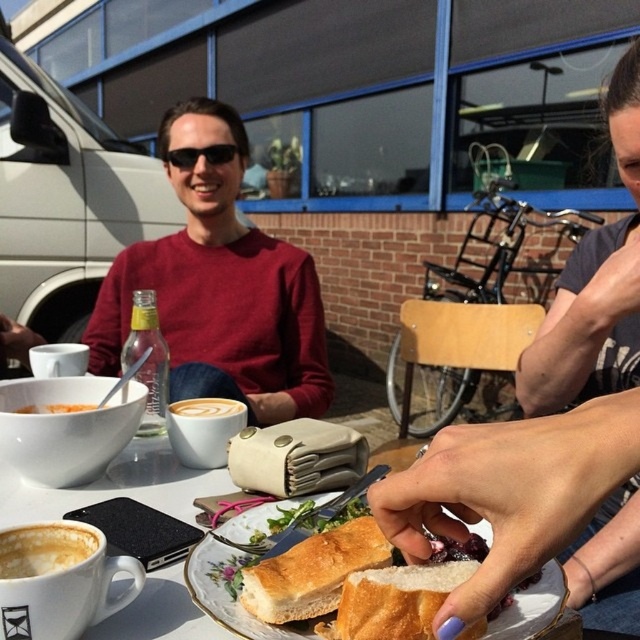
What do you see at coordinates (312, 572) in the screenshot? I see `golden bread sandwich at center` at bounding box center [312, 572].

Which is behind, point (316, 541) or point (221, 413)?

Positioned behind is point (221, 413).

Where is `golden bread sandwich at center`? Image resolution: width=640 pixels, height=640 pixels. golden bread sandwich at center is located at coordinates (312, 572).

What do you see at coordinates (312, 572) in the screenshot?
I see `golden bread sandwich at center` at bounding box center [312, 572].

Is point (314, 536) positioned in front of point (172, 161)?

Yes, it is in front of point (172, 161).

Locate an element on the screen. This screenshot has height=640, width=640. golden bread sandwich at center is located at coordinates (312, 572).

Does matte white soup at lower left have a smaller size compared to matte white bowl at center-left?

Yes, matte white soup at lower left is smaller than matte white bowl at center-left.

Does point (22, 547) come farther from viewer compared to point (40, 410)?

No, it is in front of (40, 410).

Identify the location of matte white soup at lower left. This screenshot has width=640, height=640. (44, 548).

This screenshot has height=640, width=640. Identify the location of matte white soup at lower left. (44, 548).